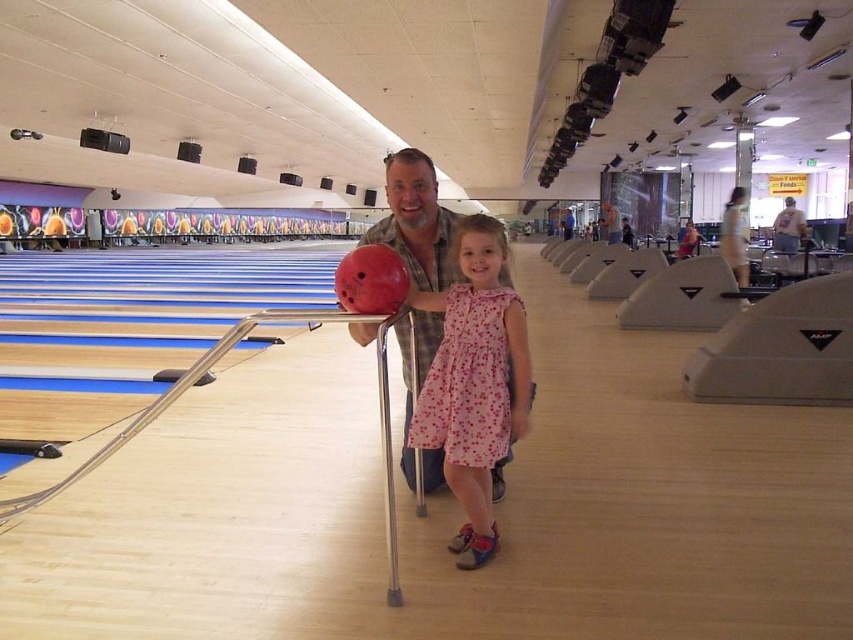
Is light brown leather jacket at upper center smaller than matte black bowling ball at center?

No, light brown leather jacket at upper center is not smaller than matte black bowling ball at center.

Does light brown leather jacket at upper center have a greater height compared to matte black bowling ball at center?

Correct, light brown leather jacket at upper center is much taller as matte black bowling ball at center.

Locate an element on the screen. The width and height of the screenshot is (853, 640). light brown leather jacket at upper center is located at coordinates click(x=788, y=227).

Is point (477, 422) farther from viewer compared to point (422, 316)?

That is False.

Which is in front, point (476, 224) or point (393, 204)?

Point (476, 224) is more forward.

Between point (492, 438) and point (502, 275), which one is positioned in front?

Point (492, 438)

Where is `pink floral dress at center`? pink floral dress at center is located at coordinates (474, 381).

Measure the distance between pink floral dress at center and camera.

pink floral dress at center is 7.48 feet away from camera.

Which is more to the left, pink floral dress at center or light brown leather jacket at upper center?

pink floral dress at center is more to the left.

Between point (450, 358) and point (788, 248), which one is positioned in front?

Positioned in front is point (450, 358).

Locate an element on the screen. Image resolution: width=853 pixels, height=640 pixels. pink floral dress at center is located at coordinates (474, 381).